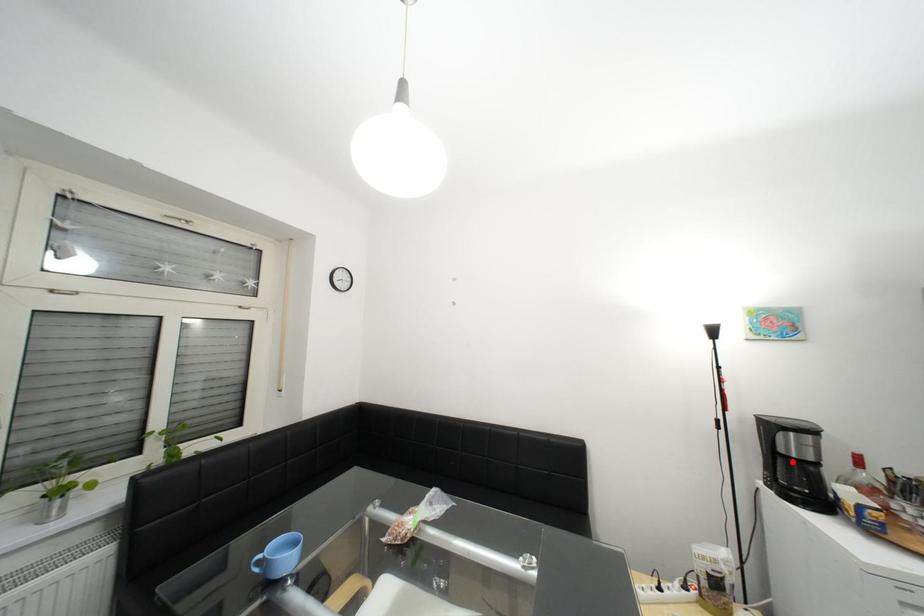
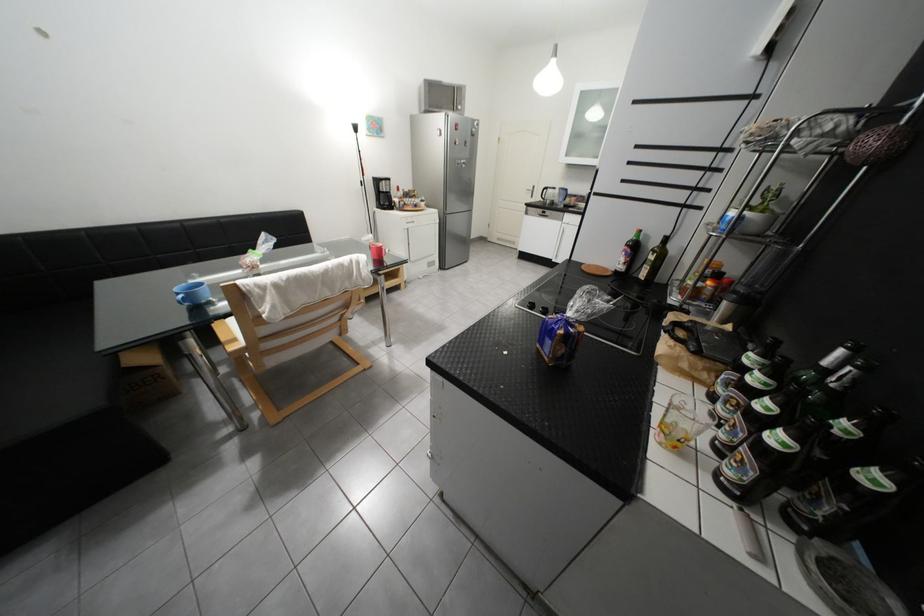
Where in the second image is the point corresponding to the highlighted location from the first image?

(393, 196)